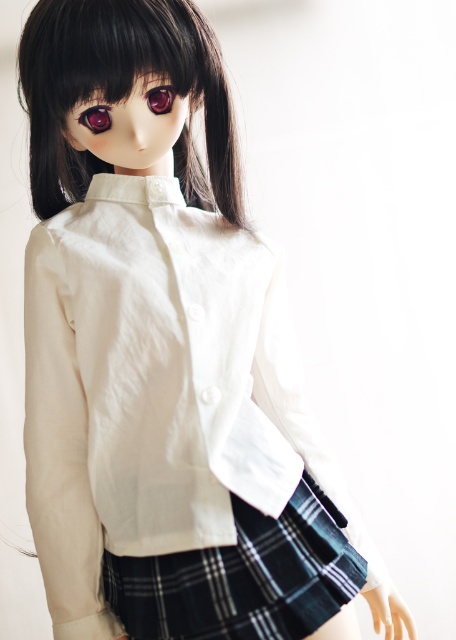
Between black plaid kilt at center and glossy plastic eye at upper left, which one has more height?

Standing taller between the two is black plaid kilt at center.

Based on the photo, who is positioned more to the left, black plaid kilt at center or glossy plastic eye at upper left?

glossy plastic eye at upper left

Is point (206, 586) more distant than point (97, 104)?

Yes, point (206, 586) is farther from viewer.

Locate an element on the screen. black plaid kilt at center is located at coordinates (243, 577).

Between black silky hair at upper center and glossy plastic eye at upper center, which one appears on the left side from the viewer's perspective?

From the viewer's perspective, black silky hair at upper center appears more on the left side.

Who is positioned more to the right, black silky hair at upper center or glossy plastic eye at upper center?

Positioned to the right is glossy plastic eye at upper center.

Is point (31, 166) less distant than point (160, 100)?

No, (31, 166) is behind (160, 100).

Identify the location of black silky hair at upper center. This screenshot has height=640, width=456. (124, 92).

Which is more to the right, black silky hair at upper center or black plaid kilt at center?

black plaid kilt at center

Who is more distant from viewer, (231, 179) or (340, 582)?

The point (231, 179) is more distant.

Is point (98, 35) closer to camera compared to point (275, 573)?

Yes, it is in front of point (275, 573).

Find the location of a particular element. This screenshot has height=640, width=456. black silky hair at upper center is located at coordinates (124, 92).